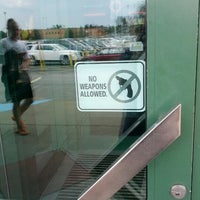
Image resolution: width=200 pixels, height=200 pixels. What are the coordinates of `green door` in the screenshot? It's located at (176, 81).